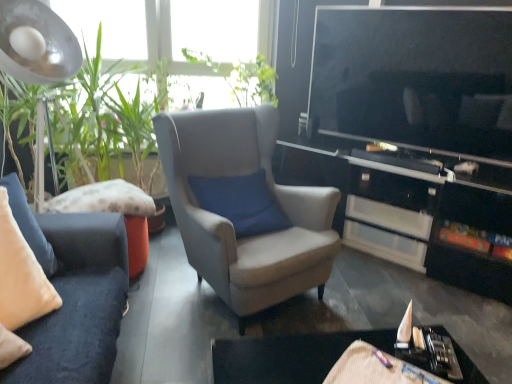
Describe the element at coordinates (90, 93) in the screenshot. The width and height of the screenshot is (512, 384). I see `green leafy plant at left` at that location.

This screenshot has width=512, height=384. What do you see at coordinates (244, 209) in the screenshot?
I see `suede-like beige armchair at center` at bounding box center [244, 209].

At what (x,y) coordinates should I click in order to perform the action: click on velvet beige pillow at left. Please return your answer as a coordinate pair (x, y). The width and height of the screenshot is (512, 384). Looking at the image, I should click on (72, 294).

From the image's perspective, is suede-like beige armchair at center located beneath black glossy table at lower right?

Incorrect, from the image's perspective, suede-like beige armchair at center is higher than black glossy table at lower right.

How many degrees apart are the facing directions of suede-like beige armchair at center and black glossy table at lower right?

They differ by 27.6 degrees in their facing directions.

Between suede-like beige armchair at center and black glossy table at lower right, which one has smaller width?

Thinner between the two is black glossy table at lower right.

Is suede-like beige armchair at center smaller than black glossy table at lower right?

Incorrect, suede-like beige armchair at center is not smaller in size than black glossy table at lower right.

Is velvet beige pillow at left at the back of green leafy plant at left?

That's not correct — green leafy plant at left is not looking away from velvet beige pillow at left.

Considering the relative positions of green leafy plant at left and velvet beige pillow at left in the image provided, is green leafy plant at left to the left of velvet beige pillow at left from the viewer's perspective?

Yes.

Is green leafy plant at left inside the boundaries of velvet beige pillow at left, or outside?

green leafy plant at left is outside velvet beige pillow at left.

Is black glossy cabinet at center to the left or to the right of velvet beige pillow at left in the image?

black glossy cabinet at center is positioned on velvet beige pillow at left's right side.

Is black glossy cabinet at center not close to velvet beige pillow at left?

Yes.

In terms of height, does black glossy cabinet at center look taller or shorter compared to velvet beige pillow at left?

In the image, black glossy cabinet at center appears to be taller than velvet beige pillow at left.

Is black glossy cabinet at center looking in the opposite direction of velvet beige pillow at left?

No.

Which object is more forward, black glossy cabinet at center or suede-like beige armchair at center?

Positioned in front is suede-like beige armchair at center.

Would you say black glossy cabinet at center is inside or outside suede-like beige armchair at center?

black glossy cabinet at center lies outside suede-like beige armchair at center.

How different are the orientations of black glossy cabinet at center and suede-like beige armchair at center in degrees?

73.1 degrees separate the facing orientations of black glossy cabinet at center and suede-like beige armchair at center.

Does black glossy cabinet at center have a lesser width compared to suede-like beige armchair at center?

Yes, black glossy cabinet at center is thinner than suede-like beige armchair at center.

Could you tell me if black glossy table at lower right is turned towards metallic silver lampshade at upper left?

No.

Considering the relative sizes of black glossy table at lower right and metallic silver lampshade at upper left in the image provided, is black glossy table at lower right taller than metallic silver lampshade at upper left?

No.

From the image's perspective, is black glossy table at lower right below metallic silver lampshade at upper left?

Correct, black glossy table at lower right appears lower than metallic silver lampshade at upper left in the image.

Considering the relative positions of green leafy plant at upper center and black glossy table at lower right in the image provided, is green leafy plant at upper center behind black glossy table at lower right?

Yes, green leafy plant at upper center is further from the camera.

Are green leafy plant at upper center and black glossy table at lower right making contact?

green leafy plant at upper center is not next to black glossy table at lower right, and they're not touching.

Is point (304, 383) closer or farther from the camera than point (143, 144)?

Clearly, point (304, 383) is closer to the camera than point (143, 144).

Find the location of a particular element. vegetation behind the black glossy table at lower right is located at coordinates (90, 93).

Looking at their sizes, would you say black glossy table at lower right is wider or thinner than green leafy plant at left?

black glossy table at lower right is thinner than green leafy plant at left.

Between black glossy table at lower right and green leafy plant at left, which one appears on the right side from the viewer's perspective?

black glossy table at lower right is more to the right.

I want to click on chair above the black glossy table at lower right (from the image's perspective), so click(x=244, y=209).

In order to click on studio couch located below the green leafy plant at left (from the image's perspective) in this screenshot , I will do `click(72, 294)`.

Looking at the image, which one is located further to green leafy plant at left, green leafy plant at upper center or black glossy cabinet at center?

Among the two, black glossy cabinet at center is located further to green leafy plant at left.

Estimate the real-world distances between objects in this image. Which object is further from black glossy cabinet at center, green leafy plant at upper center or green leafy plant at left?

green leafy plant at left lies further to black glossy cabinet at center than the other object.

From the image, which object appears to be nearer to velvet beige pillow at left, metallic silver lampshade at upper left or black glossy table at lower right?

The object closer to velvet beige pillow at left is black glossy table at lower right.

Based on their spatial positions, is velvet beige pillow at left or black glossy table at lower right closer to green leafy plant at left?

The object closer to green leafy plant at left is velvet beige pillow at left.

Based on their spatial positions, is metallic silver lampshade at upper left or black glossy table at lower right further from green leafy plant at upper center?

black glossy table at lower right.

Considering their positions, is black glossy table at lower right positioned further to green leafy plant at upper center than velvet beige pillow at left?

black glossy table at lower right is further to green leafy plant at upper center.

Based on their spatial positions, is metallic silver lampshade at upper left or black glossy cabinet at center closer to velvet beige pillow at left?

Among the two, metallic silver lampshade at upper left is located nearer to velvet beige pillow at left.

From the image, which object appears to be nearer to metallic silver lampshade at upper left, green leafy plant at left or suede-like beige armchair at center?

green leafy plant at left is closer to metallic silver lampshade at upper left.

This screenshot has width=512, height=384. What are the coordinates of `table between velvet beige pillow at left and green leafy plant at upper center along the z-axis` in the screenshot? It's located at (331, 356).

Where is `lamp located between velvet beige pillow at left and green leafy plant at upper center in the depth direction`? The height and width of the screenshot is (384, 512). lamp located between velvet beige pillow at left and green leafy plant at upper center in the depth direction is located at coordinates (44, 41).

You are a GUI agent. You are given a task and a screenshot of the screen. Output one action in this format:
    pyautogui.click(x=<x>, y=<y>)
    Task: Click on the table between velvet beige pillow at left and black glossy cabinet at center from left to right
    The height and width of the screenshot is (384, 512).
    Given the screenshot: What is the action you would take?
    pyautogui.click(x=331, y=356)

Where is `studio couch between metallic silver lampshade at upper left and suede-like beige armchair at center from left to right`? The image size is (512, 384). studio couch between metallic silver lampshade at upper left and suede-like beige armchair at center from left to right is located at coordinates (72, 294).